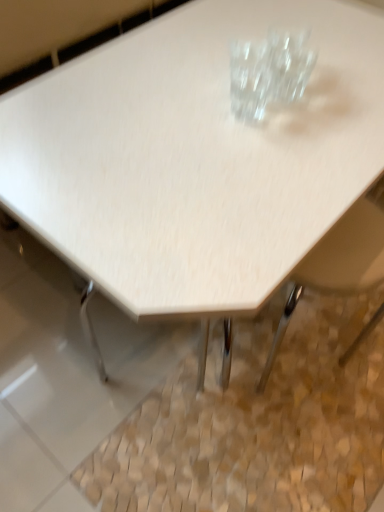
Image resolution: width=384 pixels, height=512 pixels. What do you see at coordinates (340, 260) in the screenshot?
I see `metallic silver chair at lower right` at bounding box center [340, 260].

Locate an element on the screen. metallic silver chair at lower right is located at coordinates (340, 260).

This screenshot has height=512, width=384. I want to click on metallic silver chair at lower right, so click(340, 260).